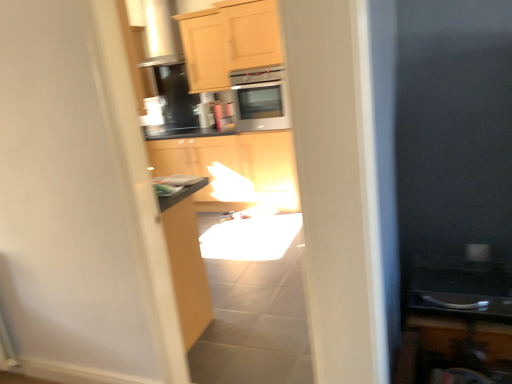
What do you see at coordinates (194, 155) in the screenshot? The image size is (512, 384). I see `matte wood cabinet at center, marked as the 2th cabinetry in a bottom-to-top arrangement` at bounding box center [194, 155].

Image resolution: width=512 pixels, height=384 pixels. Describe the element at coordinates (260, 99) in the screenshot. I see `satin silver microwave at center` at that location.

What are the coordinates of `satin silver microwave at center` in the screenshot? It's located at (260, 99).

Find the location of a particular element. This screenshot has width=512, height=384. light wood cabinet at upper center, marked as the 1th cabinetry in a top-to-bottom arrangement is located at coordinates (204, 51).

Is light wood cabinet at upper center, acting as the second cabinetry starting from the back, positioned in front of satin silver microwave at center?

No, the depth of light wood cabinet at upper center, acting as the second cabinetry starting from the back, is greater than that of satin silver microwave at center.

Is light wood cabinet at upper center, which is the 3th cabinetry from bottom to top, far from satin silver microwave at center?

Actually, light wood cabinet at upper center, which is the 3th cabinetry from bottom to top, and satin silver microwave at center are a little close together.

At what (x,y) coordinates should I click in order to perform the action: click on microwave oven that appears on the right of light wood cabinet at upper center, marked as the 1th cabinetry in a top-to-bottom arrangement. Please return your answer as a coordinate pair (x, y). Looking at the image, I should click on (260, 99).

Based on the photo, does light wood cabinet at upper center, placed as the second cabinetry when sorted from right to left, turn towards satin silver microwave at center?

No, light wood cabinet at upper center, placed as the second cabinetry when sorted from right to left, is not facing towards satin silver microwave at center.

Is light wood cabinet at upper center, acting as the 2th cabinetry starting from the front, far from matte wood cabinet at center, marked as the 2th cabinetry in a bottom-to-top arrangement?

light wood cabinet at upper center, acting as the 2th cabinetry starting from the front, is actually quite close to matte wood cabinet at center, marked as the 2th cabinetry in a bottom-to-top arrangement.

Is point (222, 61) positioned before point (174, 143)?

Yes, point (222, 61) is in front of point (174, 143).

Does light wood cabinet at upper center, placed as the second cabinetry when sorted from right to left, have a greater height compared to matte wood cabinet at center, marked as the 2th cabinetry in a bottom-to-top arrangement?

In fact, light wood cabinet at upper center, placed as the second cabinetry when sorted from right to left, may be shorter than matte wood cabinet at center, marked as the 2th cabinetry in a bottom-to-top arrangement.

Which of these two, light wood cabinet at upper center, marked as the 1th cabinetry in a top-to-bottom arrangement, or matte wood cabinet at center, acting as the 1th cabinetry starting from the left, is thinner?

Thinner between the two is matte wood cabinet at center, acting as the 1th cabinetry starting from the left.

Is wooden cabinet at lower right, the first cabinetry from the bottom, positioned behind satin silver microwave at center?

That is False.

Is wooden cabinet at lower right, the third cabinetry in the back-to-front sequence, bigger than satin silver microwave at center?

Incorrect, wooden cabinet at lower right, the third cabinetry in the back-to-front sequence, is not larger than satin silver microwave at center.

From the image's perspective, which one is positioned higher, wooden cabinet at lower right, the first cabinetry from the bottom, or satin silver microwave at center?

From the image's view, satin silver microwave at center is above.

At what (x,y) coordinates should I click in order to perform the action: click on microwave oven above the wooden cabinet at lower right, which is the first cabinetry in front-to-back order (from the image's perspective). Please return your answer as a coordinate pair (x, y). Looking at the image, I should click on (260, 99).

Based on the photo, from the image's perspective, which object appears higher, light wood cabinet at upper center, acting as the 2th cabinetry starting from the front, or wooden cabinet at lower right, which is the 3th cabinetry from top to bottom?

light wood cabinet at upper center, acting as the 2th cabinetry starting from the front, is shown above in the image.

Is light wood cabinet at upper center, acting as the second cabinetry starting from the back, spatially inside wooden cabinet at lower right, which is the first cabinetry in front-to-back order, or outside of it?

light wood cabinet at upper center, acting as the second cabinetry starting from the back, is not inside wooden cabinet at lower right, which is the first cabinetry in front-to-back order, it's outside.

Considering the sizes of objects light wood cabinet at upper center, acting as the second cabinetry starting from the back, and wooden cabinet at lower right, the first cabinetry from the bottom, in the image provided, who is smaller, light wood cabinet at upper center, acting as the second cabinetry starting from the back, or wooden cabinet at lower right, the first cabinetry from the bottom,?

wooden cabinet at lower right, the first cabinetry from the bottom, is smaller.

Which object is positioned more to the right, light wood cabinet at upper center, the second cabinetry positioned from the left, or wooden cabinet at lower right, which is the 3th cabinetry from top to bottom?

From the viewer's perspective, wooden cabinet at lower right, which is the 3th cabinetry from top to bottom, appears more on the right side.

Is point (164, 146) closer to viewer compared to point (428, 339)?

No, it is behind (428, 339).

Which object is further away from the camera, matte wood cabinet at center, marked as the 1th cabinetry in a back-to-front arrangement, or wooden cabinet at lower right, which is the 3th cabinetry from top to bottom?

matte wood cabinet at center, marked as the 1th cabinetry in a back-to-front arrangement, is further from the camera.

Are matte wood cabinet at center, which appears as the second cabinetry when viewed from the top, and wooden cabinet at lower right, the first cabinetry from the bottom, making contact?

No, matte wood cabinet at center, which appears as the second cabinetry when viewed from the top, is not making contact with wooden cabinet at lower right, the first cabinetry from the bottom.

Is satin silver microwave at center next to matte wood cabinet at center, marked as the 2th cabinetry in a bottom-to-top arrangement?

No, satin silver microwave at center is not in contact with matte wood cabinet at center, marked as the 2th cabinetry in a bottom-to-top arrangement.

Between satin silver microwave at center and matte wood cabinet at center, which appears as the second cabinetry when viewed from the top, which one is positioned in front?

satin silver microwave at center is in front.

Considering the sizes of objects satin silver microwave at center and matte wood cabinet at center, which appears as the second cabinetry when viewed from the top, in the image provided, who is smaller, satin silver microwave at center or matte wood cabinet at center, which appears as the second cabinetry when viewed from the top,?

matte wood cabinet at center, which appears as the second cabinetry when viewed from the top, is smaller.

Is satin silver microwave at center not inside matte wood cabinet at center, marked as the 2th cabinetry in a bottom-to-top arrangement?

Indeed, satin silver microwave at center is completely outside matte wood cabinet at center, marked as the 2th cabinetry in a bottom-to-top arrangement.

Does point (234, 120) lie in front of point (182, 15)?

No, (234, 120) is behind (182, 15).

Identify the location of the 1st cabinetry behind the satin silver microwave at center. The image size is (512, 384). (204, 51).

Is satin silver microwave at center in front of or behind light wood cabinet at upper center, the second cabinetry positioned from the left, in the image?

Visually, satin silver microwave at center is located in front of light wood cabinet at upper center, the second cabinetry positioned from the left.

From the satin silver microwave at center, count 1st cabinetrys backward and point to it. Please provide its 2D coordinates.

[(204, 51)]

The width and height of the screenshot is (512, 384). I want to click on the 1st cabinetry below the light wood cabinet at upper center, placed as the second cabinetry when sorted from right to left (from the image's perspective), so click(194, 155).

Which object lies further to the anchor point satin silver microwave at center, light wood cabinet at upper center, marked as the 1th cabinetry in a top-to-bottom arrangement, or matte wood cabinet at center, acting as the 1th cabinetry starting from the left?

matte wood cabinet at center, acting as the 1th cabinetry starting from the left.

From the image, which object appears to be farther from wooden cabinet at lower right, the third cabinetry in the back-to-front sequence, light wood cabinet at upper center, acting as the second cabinetry starting from the back, or satin silver microwave at center?

Based on the image, satin silver microwave at center appears to be further to wooden cabinet at lower right, the third cabinetry in the back-to-front sequence.

Looking at the image, which one is located further to wooden cabinet at lower right, which is the third cabinetry from left to right, matte wood cabinet at center, arranged as the 3th cabinetry when viewed from the right, or satin silver microwave at center?

satin silver microwave at center is further to wooden cabinet at lower right, which is the third cabinetry from left to right.

Looking at the image, which one is located closer to light wood cabinet at upper center, acting as the second cabinetry starting from the back, matte wood cabinet at center, acting as the 1th cabinetry starting from the left, or wooden cabinet at lower right, the third cabinetry in the back-to-front sequence?

matte wood cabinet at center, acting as the 1th cabinetry starting from the left, lies closer to light wood cabinet at upper center, acting as the second cabinetry starting from the back, than the other object.

Looking at the image, which one is located further to matte wood cabinet at center, arranged as the 3th cabinetry when viewed from the right, wooden cabinet at lower right, arranged as the first cabinetry when viewed from the right, or satin silver microwave at center?

wooden cabinet at lower right, arranged as the first cabinetry when viewed from the right, is positioned further to the anchor matte wood cabinet at center, arranged as the 3th cabinetry when viewed from the right.

Looking at the image, which one is located further to wooden cabinet at lower right, which is the third cabinetry from left to right, light wood cabinet at upper center, the second cabinetry positioned from the left, or matte wood cabinet at center, which appears as the second cabinetry when viewed from the top?

light wood cabinet at upper center, the second cabinetry positioned from the left, is further to wooden cabinet at lower right, which is the third cabinetry from left to right.

When comparing their distances from satin silver microwave at center, does matte wood cabinet at center, marked as the 2th cabinetry in a bottom-to-top arrangement, or wooden cabinet at lower right, the third cabinetry in the back-to-front sequence, seem further?

The object further to satin silver microwave at center is wooden cabinet at lower right, the third cabinetry in the back-to-front sequence.

Which object lies further to the anchor point wooden cabinet at lower right, the third cabinetry in the back-to-front sequence, satin silver microwave at center or matte wood cabinet at center, acting as the 1th cabinetry starting from the left?

satin silver microwave at center is further to wooden cabinet at lower right, the third cabinetry in the back-to-front sequence.

The width and height of the screenshot is (512, 384). I want to click on microwave oven located between wooden cabinet at lower right, the third cabinetry in the back-to-front sequence, and light wood cabinet at upper center, acting as the 2th cabinetry starting from the front, in the depth direction, so click(260, 99).

Image resolution: width=512 pixels, height=384 pixels. What are the coordinates of `microwave oven that lies between light wood cabinet at upper center, marked as the 1th cabinetry in a top-to-bottom arrangement, and matte wood cabinet at center, the 3th cabinetry from the front, from top to bottom` in the screenshot? It's located at (260, 99).

What are the coordinates of `microwave oven between wooden cabinet at lower right, which is the 3th cabinetry from top to bottom, and matte wood cabinet at center, which appears as the second cabinetry when viewed from the top, in the front-back direction` in the screenshot? It's located at (260, 99).

Locate an element on the screen. cabinetry located between wooden cabinet at lower right, which is the third cabinetry from left to right, and matte wood cabinet at center, marked as the 2th cabinetry in a bottom-to-top arrangement, in the depth direction is located at coordinates (204, 51).